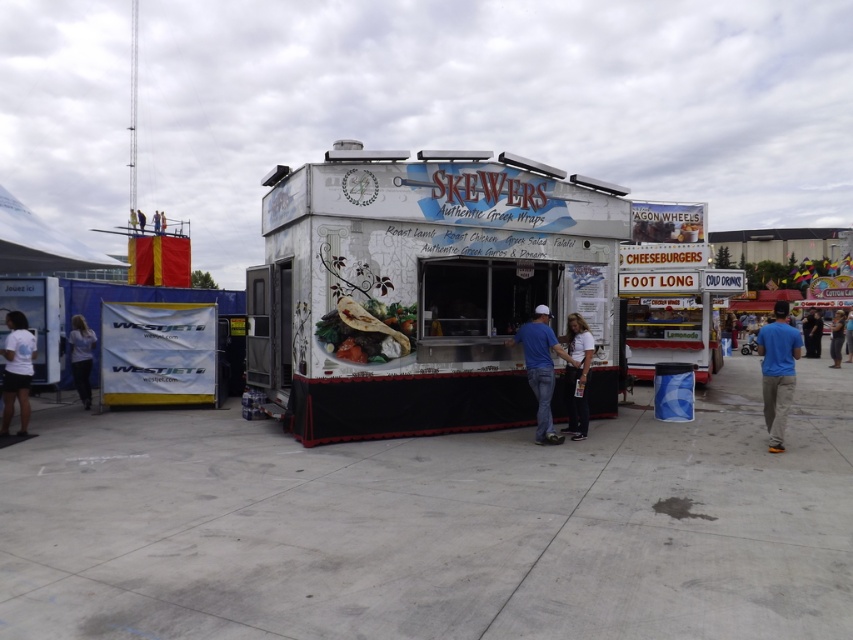
Question: Among these objects, which one is nearest to the camera?

Choices:
 (A) blue jeans at left
 (B) blue cotton shirt at center
 (C) white cotton shirt at center

Answer: (B)

Question: Is blue cotton shirt at center smaller than light brown fabric pants at lower right?

Choices:
 (A) yes
 (B) no

Answer: (A)

Question: Among these points, which one is nearest to the camera?

Choices:
 (A) (343, 387)
 (B) (25, 362)
 (C) (544, 352)
 (D) (810, 355)

Answer: (A)

Question: Does matte white pita bread at center have a smaller size compared to white cotton shirt at center?

Choices:
 (A) no
 (B) yes

Answer: (A)

Question: Observing the image, what is the correct spatial positioning of matte white pita bread at center in reference to white cotton shirt at center?

Choices:
 (A) above
 (B) below

Answer: (A)

Question: Which object is farther from the camera taking this photo?

Choices:
 (A) blue cotton shirt at center
 (B) blue cotton shirt at right
 (C) blue jeans at left
 (D) white glossy food truck at center

Answer: (C)